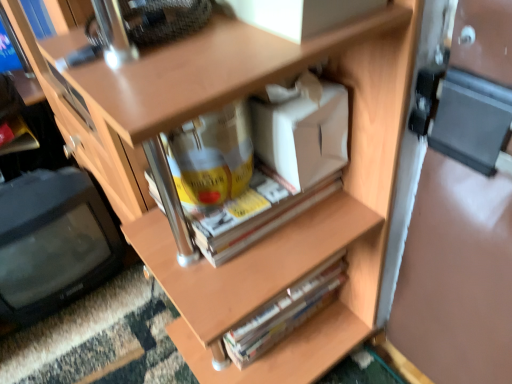
The image size is (512, 384). I want to click on free space on the front side of black plastic computer monitor at left, so [x=77, y=345].